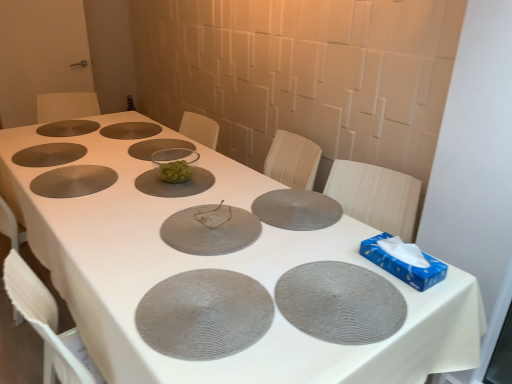
You are a GUI agent. You are given a task and a screenshot of the screen. Output one action in this format:
    pyautogui.click(x=<x>, y=<y>)
    Task: Click on the free area behind matte gray placemat at left, which appears as the fifth glass plate when viewed from the front
    
    Given the screenshot: What is the action you would take?
    click(x=99, y=153)